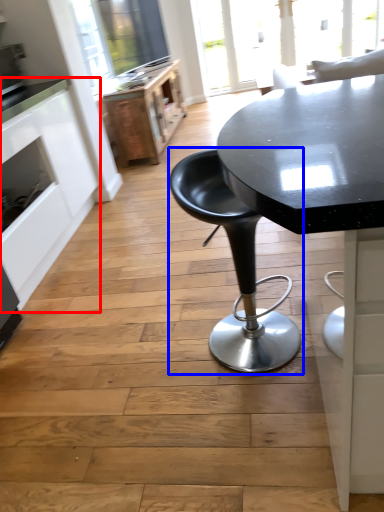
Question: Which of the following is the closest to the observer, cabinetry (highlighted by a red box) or chair (highlighted by a blue box)?

Choices:
 (A) cabinetry
 (B) chair

Answer: (B)